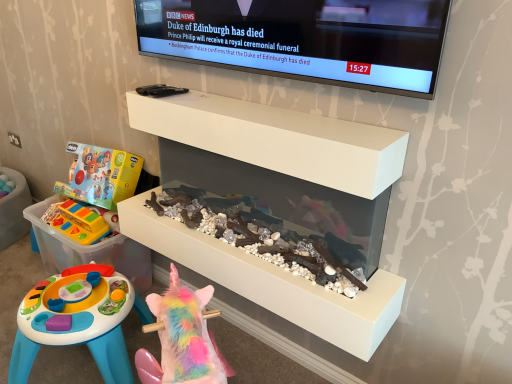
At what (x,y) coordinates should I click in order to perform the action: click on black glossy tv at upper center. Please return your answer as a coordinate pair (x, y). Looking at the image, I should click on (304, 39).

Describe the element at coordinates (277, 139) in the screenshot. I see `white matte shelf at upper center` at that location.

Measure the distance between point [290,143] and camera.

The depth of point [290,143] is 1.17 meters.

Identify the location of rainbow plush unicorn at lower center, acting as the 1th toy starting from the front. The width and height of the screenshot is (512, 384). (182, 339).

What do you see at coordinates (182, 339) in the screenshot? I see `rainbow plush unicorn at lower center, arranged as the 2th toy when viewed from the back` at bounding box center [182, 339].

Identify the location of translucent plastic storage box at lower left. The width and height of the screenshot is (512, 384). (89, 250).

Is rubberized plastic toy at left, the 2th toy viewed from the right, oriented away from black glossy tv at upper center?

That's not correct — rubberized plastic toy at left, the 2th toy viewed from the right, is not looking away from black glossy tv at upper center.

Is rubberized plastic toy at left, the first toy viewed from the top, beside black glossy tv at upper center?

There is a gap between rubberized plastic toy at left, the first toy viewed from the top, and black glossy tv at upper center.

In terms of height, does rubberized plastic toy at left, the 1th toy from the left, look taller or shorter compared to black glossy tv at upper center?

Considering their sizes, rubberized plastic toy at left, the 1th toy from the left, has less height than black glossy tv at upper center.

Is rubberized plastic toy at left, the 2th toy viewed from the right, to the right of black glossy tv at upper center from the viewer's perspective?

In fact, rubberized plastic toy at left, the 2th toy viewed from the right, is to the left of black glossy tv at upper center.

Consider the image. Is black glossy tv at upper center situated inside rubberized plastic toy at left, which ranks as the 2th toy in bottom-to-top order, or outside?

black glossy tv at upper center exists outside the volume of rubberized plastic toy at left, which ranks as the 2th toy in bottom-to-top order.

Does black glossy tv at upper center have a lesser height compared to rubberized plastic toy at left, positioned as the 1th toy in back-to-front order?

In fact, black glossy tv at upper center may be taller than rubberized plastic toy at left, positioned as the 1th toy in back-to-front order.

From the picture: Could you tell me if black glossy tv at upper center is facing rubberized plastic toy at left, the 1th toy from the left?

No, black glossy tv at upper center is not aimed at rubberized plastic toy at left, the 1th toy from the left.

Is black glossy tv at upper center in contact with rubberized plastic toy at left, the first toy viewed from the top?

black glossy tv at upper center is not next to rubberized plastic toy at left, the first toy viewed from the top, and they're not touching.

Based on the photo, do you think black glossy tv at upper center is within translucent plastic storage box at lower left, or outside of it?

black glossy tv at upper center exists outside the volume of translucent plastic storage box at lower left.

From a real-world perspective, is black glossy tv at upper center positioned over translucent plastic storage box at lower left based on gravity?

Yes, from a real-world perspective, black glossy tv at upper center is above translucent plastic storage box at lower left.

In the image, is black glossy tv at upper center positioned in front of or behind translucent plastic storage box at lower left?

Clearly, black glossy tv at upper center is in front of translucent plastic storage box at lower left.

Which of these two, black glossy tv at upper center or translucent plastic storage box at lower left, stands taller?

translucent plastic storage box at lower left.

Looking at this image, considering the relative positions of rubberized plastic toy at left, which ranks as the 2th toy in bottom-to-top order, and translucent plastic storage box at lower left in the image provided, is rubberized plastic toy at left, which ranks as the 2th toy in bottom-to-top order, to the left or to the right of translucent plastic storage box at lower left?

rubberized plastic toy at left, which ranks as the 2th toy in bottom-to-top order, is positioned on translucent plastic storage box at lower left's right side.

In the image, is rubberized plastic toy at left, the 1th toy from the left, positioned in front of or behind translucent plastic storage box at lower left?

rubberized plastic toy at left, the 1th toy from the left, is positioned closer to the viewer than translucent plastic storage box at lower left.

Between rubberized plastic toy at left, which ranks as the 2th toy in bottom-to-top order, and translucent plastic storage box at lower left, which one has smaller size?

rubberized plastic toy at left, which ranks as the 2th toy in bottom-to-top order.

Is rubberized plastic toy at left, which ranks as the 2th toy in bottom-to-top order, oriented away from translucent plastic storage box at lower left?

Correct, rubberized plastic toy at left, which ranks as the 2th toy in bottom-to-top order, is looking away from translucent plastic storage box at lower left.

Is white glossy aquarium at center positioned with its back to white matte shelf at upper center?

white glossy aquarium at center does not have its back to white matte shelf at upper center.

Considering the relative positions of white glossy aquarium at center and white matte shelf at upper center in the image provided, is white glossy aquarium at center in front of white matte shelf at upper center?

That is False.

Is white glossy aquarium at center in contact with white matte shelf at upper center?

No.

Considering the sizes of white glossy aquarium at center and black glossy tv at upper center in the image, is white glossy aquarium at center wider or thinner than black glossy tv at upper center?

white glossy aquarium at center is wider than black glossy tv at upper center.

Do you think white glossy aquarium at center is within black glossy tv at upper center, or outside of it?

white glossy aquarium at center exists outside the volume of black glossy tv at upper center.

From the image's perspective, between white glossy aquarium at center and black glossy tv at upper center, which one is located above?

black glossy tv at upper center.

Considering the sizes of white glossy aquarium at center and black glossy tv at upper center in the image, is white glossy aquarium at center taller or shorter than black glossy tv at upper center?

Considering their sizes, white glossy aquarium at center has more height than black glossy tv at upper center.

Considering the sizes of objects rainbow plush unicorn at lower center, which is the 2th toy in top-to-bottom order, and white matte shelf at upper center in the image provided, who is shorter, rainbow plush unicorn at lower center, which is the 2th toy in top-to-bottom order, or white matte shelf at upper center?

Standing shorter between the two is white matte shelf at upper center.

Measure the distance from rainbow plush unicorn at lower center, which is counted as the 1th toy, starting from the bottom, to white matte shelf at upper center.

They are 21.75 inches apart.

Which of these two, rainbow plush unicorn at lower center, which appears as the first toy when viewed from the right, or white matte shelf at upper center, is wider?

With larger width is rainbow plush unicorn at lower center, which appears as the first toy when viewed from the right.

From the image's perspective, which object appears higher, rainbow plush unicorn at lower center, which is counted as the 1th toy, starting from the bottom, or white matte shelf at upper center?

white matte shelf at upper center, from the image's perspective.

Where is `toy behind the black glossy tv at upper center`? The width and height of the screenshot is (512, 384). toy behind the black glossy tv at upper center is located at coordinates (77, 222).

Identify the location of television that is on the right side of rubberized plastic toy at left, the 2th toy viewed from the right. This screenshot has height=384, width=512. (304, 39).

When comparing their distances from white matte shelf at upper center, does black glossy tv at upper center or rainbow plush unicorn at lower center, which is the 2th toy in top-to-bottom order, seem closer?

The object closer to white matte shelf at upper center is black glossy tv at upper center.

Based on their spatial positions, is white matte shelf at upper center or rubberized plastic toy at left, which ranks as the 2th toy in bottom-to-top order, further from black glossy tv at upper center?

rubberized plastic toy at left, which ranks as the 2th toy in bottom-to-top order, is further to black glossy tv at upper center.

Estimate the real-world distances between objects in this image. Which object is further from white matte shelf at upper center, white glossy aquarium at center or translucent plastic storage box at lower left?

translucent plastic storage box at lower left is further to white matte shelf at upper center.

Estimate the real-world distances between objects in this image. Which object is closer to white matte shelf at upper center, black glossy tv at upper center or white glossy aquarium at center?

white glossy aquarium at center is closer to white matte shelf at upper center.

From the image, which object appears to be nearer to black glossy tv at upper center, rainbow plush unicorn at lower center, acting as the 1th toy starting from the front, or white glossy aquarium at center?

Among the two, white glossy aquarium at center is located nearer to black glossy tv at upper center.

When comparing their distances from white matte shelf at upper center, does white glossy aquarium at center or black glossy tv at upper center seem closer?

The object closer to white matte shelf at upper center is white glossy aquarium at center.

Which object lies further to the anchor point white glossy aquarium at center, translucent plastic storage box at lower left or black glossy tv at upper center?

Among the two, translucent plastic storage box at lower left is located further to white glossy aquarium at center.

When comparing their distances from white glossy aquarium at center, does rainbow plush unicorn at lower center, which appears as the first toy when viewed from the right, or black glossy tv at upper center seem further?

rainbow plush unicorn at lower center, which appears as the first toy when viewed from the right, is further to white glossy aquarium at center.

Locate an element on the screen. The image size is (512, 384). furniture located between rubberized plastic toy at left, which ranks as the 2th toy in bottom-to-top order, and white matte shelf at upper center in the left-right direction is located at coordinates pos(274,207).

Locate an element on the screen. The image size is (512, 384). shelf between black glossy tv at upper center and white glossy aquarium at center in the up-down direction is located at coordinates (x=277, y=139).

In order to click on furniture between translucent plastic storage box at lower left and white matte shelf at upper center in the horizontal direction in this screenshot , I will do click(274, 207).

At what (x,y) coordinates should I click in order to perform the action: click on furniture situated between translucent plastic storage box at lower left and black glossy tv at upper center from left to right. Please return your answer as a coordinate pair (x, y). Image resolution: width=512 pixels, height=384 pixels. Looking at the image, I should click on (274, 207).